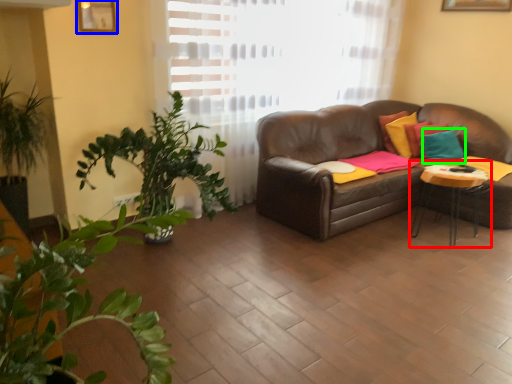
Question: Considering the real-world distances, which object is closest to table (highlighted by a red box)? picture frame (highlighted by a blue box) or pillow (highlighted by a green box).

Choices:
 (A) picture frame
 (B) pillow

Answer: (B)